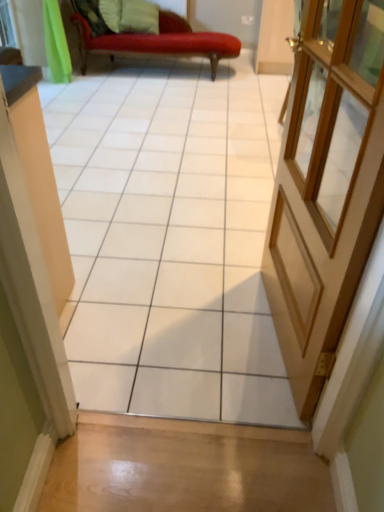
Question: Should I look upward or downward to see white glossy tile at center?

Choices:
 (A) up
 (B) down

Answer: (B)

Question: Does light brown wooden door at right appear on the left side of white glossy tile at center?

Choices:
 (A) yes
 (B) no

Answer: (B)

Question: Considering the relative sizes of light brown wooden door at right and white glossy tile at center in the image provided, is light brown wooden door at right bigger than white glossy tile at center?

Choices:
 (A) yes
 (B) no

Answer: (B)

Question: From the image's perspective, is light brown wooden door at right on top of white glossy tile at center?

Choices:
 (A) no
 (B) yes

Answer: (B)

Question: From a real-world perspective, is light brown wooden door at right below white glossy tile at center?

Choices:
 (A) yes
 (B) no

Answer: (A)

Question: Does light brown wooden door at right appear on the right side of white glossy tile at center?

Choices:
 (A) no
 (B) yes

Answer: (B)

Question: Is light brown wooden door at right positioned with its back to white glossy tile at center?

Choices:
 (A) yes
 (B) no

Answer: (B)

Question: Is light brown wooden door at right inside white glossy tile at center?

Choices:
 (A) yes
 (B) no

Answer: (B)

Question: Can you confirm if white glossy tile at center is thinner than light brown wooden door at right?

Choices:
 (A) yes
 (B) no

Answer: (B)

Question: Is white glossy tile at center to the left of light brown wooden door at right from the viewer's perspective?

Choices:
 (A) no
 (B) yes

Answer: (B)

Question: Is white glossy tile at center closer to camera compared to light brown wooden door at right?

Choices:
 (A) no
 (B) yes

Answer: (B)

Question: Does white glossy tile at center touch light brown wooden door at right?

Choices:
 (A) no
 (B) yes

Answer: (A)

Question: Is white glossy tile at center shorter than light brown wooden door at right?

Choices:
 (A) yes
 (B) no

Answer: (B)

Question: From the image's perspective, does green fabric pillow at upper center appear lower than light brown wooden door at right?

Choices:
 (A) yes
 (B) no

Answer: (B)